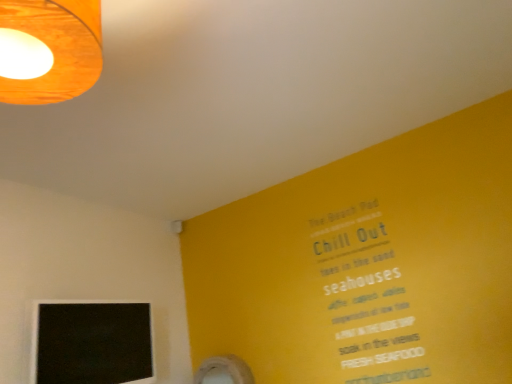
This screenshot has height=384, width=512. What do you see at coordinates (92, 343) in the screenshot? I see `black matte computer monitor at lower left` at bounding box center [92, 343].

Image resolution: width=512 pixels, height=384 pixels. What are the coordinates of `black matte computer monitor at lower left` in the screenshot? It's located at (92, 343).

Measure the distance between wooden lampshade at upper left and camera.

29.84 inches.

Describe the element at coordinates (48, 49) in the screenshot. I see `wooden lampshade at upper left` at that location.

This screenshot has width=512, height=384. Find the location of `wooden lampshade at upper left`. wooden lampshade at upper left is located at coordinates (48, 49).

In order to face wooden lampshade at upper left, should I rotate leftwards or rightwards?

Turn left approximately 28.024 degrees to face it.

Locate an element on the screen. The height and width of the screenshot is (384, 512). black matte computer monitor at lower left is located at coordinates (92, 343).

Can you confirm if wooden lampshade at upper left is positioned to the left of black matte computer monitor at lower left?

In fact, wooden lampshade at upper left is to the right of black matte computer monitor at lower left.

Who is more distant, wooden lampshade at upper left or black matte computer monitor at lower left?

black matte computer monitor at lower left is behind.

Considering the points (79, 41) and (45, 352), which point is in front, point (79, 41) or point (45, 352)?

Positioned in front is point (79, 41).

From the image's perspective, would you say wooden lampshade at upper left is positioned over black matte computer monitor at lower left?

Correct, wooden lampshade at upper left appears higher than black matte computer monitor at lower left in the image.

From a real-world perspective, is wooden lampshade at upper left physically located above or below black matte computer monitor at lower left?

Clearly, from a real-world perspective, wooden lampshade at upper left is above black matte computer monitor at lower left.

Looking at their sizes, would you say wooden lampshade at upper left is wider or thinner than black matte computer monitor at lower left?

In the image, wooden lampshade at upper left appears to be wider than black matte computer monitor at lower left.

Is wooden lampshade at upper left shorter than black matte computer monitor at lower left?

Correct, wooden lampshade at upper left is not as tall as black matte computer monitor at lower left.

Based on their sizes in the image, would you say wooden lampshade at upper left is bigger or smaller than black matte computer monitor at lower left?

Clearly, wooden lampshade at upper left is smaller in size than black matte computer monitor at lower left.

Is wooden lampshade at upper left situated inside black matte computer monitor at lower left or outside?

wooden lampshade at upper left is outside black matte computer monitor at lower left.

From the picture: Is wooden lampshade at upper left not close to black matte computer monitor at lower left?

Yes, wooden lampshade at upper left is far from black matte computer monitor at lower left.

Could you tell me if wooden lampshade at upper left is turned towards black matte computer monitor at lower left?

No.

Can you tell me how much wooden lampshade at upper left and black matte computer monitor at lower left differ in facing direction?

Answer: They differ by 179 degrees in their facing directions.

Where is `computer monitor behind the wooden lampshade at upper left`? The height and width of the screenshot is (384, 512). computer monitor behind the wooden lampshade at upper left is located at coordinates (92, 343).

Which is more to the right, black matte computer monitor at lower left or wooden lampshade at upper left?

wooden lampshade at upper left is more to the right.

Based on the photo, is the depth of black matte computer monitor at lower left greater than that of wooden lampshade at upper left?

Yes, black matte computer monitor at lower left is behind wooden lampshade at upper left.

Which is in front, point (122, 310) or point (14, 47)?

The point (14, 47) is in front.

In the scene shown: From the image's perspective, would you say black matte computer monitor at lower left is shown under wooden lampshade at upper left?

Indeed, from the image's perspective, black matte computer monitor at lower left is shown beneath wooden lampshade at upper left.

From a real-world perspective, between black matte computer monitor at lower left and wooden lampshade at upper left, who is vertically higher?

In real-world perspective, wooden lampshade at upper left is above.

Considering the sizes of objects black matte computer monitor at lower left and wooden lampshade at upper left in the image provided, who is wider, black matte computer monitor at lower left or wooden lampshade at upper left?

wooden lampshade at upper left.

Consider the image. Does black matte computer monitor at lower left have a lesser height compared to wooden lampshade at upper left?

Incorrect, the height of black matte computer monitor at lower left does not fall short of that of wooden lampshade at upper left.

Considering the sizes of objects black matte computer monitor at lower left and wooden lampshade at upper left in the image provided, who is smaller, black matte computer monitor at lower left or wooden lampshade at upper left?

wooden lampshade at upper left is smaller.

Which is correct: black matte computer monitor at lower left is inside wooden lampshade at upper left, or outside of it?

black matte computer monitor at lower left lies outside wooden lampshade at upper left.

Is there a large distance between black matte computer monitor at lower left and wooden lampshade at upper left?

That's right, there is a large distance between black matte computer monitor at lower left and wooden lampshade at upper left.

Could you tell me if black matte computer monitor at lower left is facing wooden lampshade at upper left?

No, black matte computer monitor at lower left is not facing towards wooden lampshade at upper left.

There is a black matte computer monitor at lower left. At what (x,y) coordinates should I click in order to perform the action: click on lamp above it (from a real-world perspective). Please return your answer as a coordinate pair (x, y). Image resolution: width=512 pixels, height=384 pixels. Looking at the image, I should click on (48, 49).

Where is `computer monitor below the wooden lampshade at upper left (from a real-world perspective)`? This screenshot has width=512, height=384. computer monitor below the wooden lampshade at upper left (from a real-world perspective) is located at coordinates (92, 343).

Locate an element on the screen. This screenshot has width=512, height=384. lamp located above the black matte computer monitor at lower left (from a real-world perspective) is located at coordinates (48, 49).